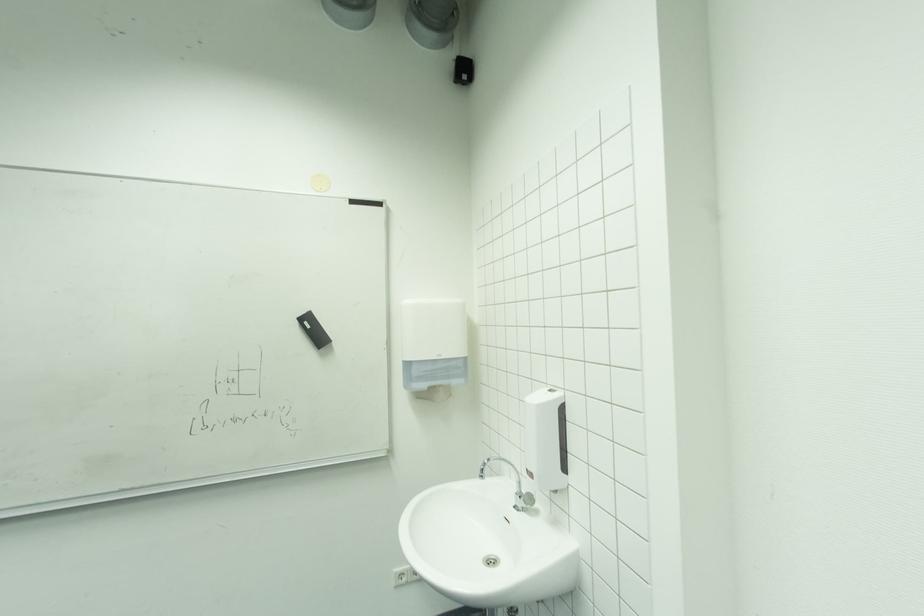
You are a GUI agent. You are given a task and a screenshot of the screen. Output one action in this format:
    pyautogui.click(x=<x>, y=<y>)
    Task: Click on the paper towel
    The image size is (924, 616).
    Given the screenshot: What is the action you would take?
    pyautogui.click(x=433, y=373)